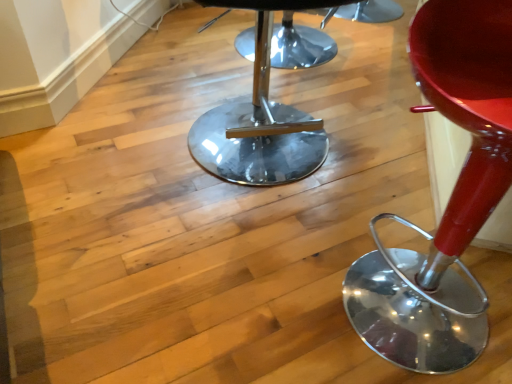
Question: Considering the relative positions of glossy red stool at right and polished chrome stool at center in the image provided, is glossy red stool at right in front of polished chrome stool at center?

Choices:
 (A) no
 (B) yes

Answer: (B)

Question: Is glossy red stool at right taller than polished chrome stool at center?

Choices:
 (A) no
 (B) yes

Answer: (B)

Question: From a real-world perspective, does glossy red stool at right sit lower than polished chrome stool at center?

Choices:
 (A) yes
 (B) no

Answer: (B)

Question: Are glossy red stool at right and polished chrome stool at center located far from each other?

Choices:
 (A) yes
 (B) no

Answer: (B)

Question: Is polished chrome stool at center surrounded by glossy red stool at right?

Choices:
 (A) no
 (B) yes

Answer: (A)

Question: From the image's perspective, would you say glossy red stool at right is shown under polished chrome stool at center?

Choices:
 (A) yes
 (B) no

Answer: (A)

Question: Are polished chrome stool at center and glossy red stool at right located far from each other?

Choices:
 (A) yes
 (B) no

Answer: (B)

Question: Does polished chrome stool at center have a lesser width compared to glossy red stool at right?

Choices:
 (A) no
 (B) yes

Answer: (A)

Question: Is polished chrome stool at center wider than glossy red stool at right?

Choices:
 (A) no
 (B) yes

Answer: (B)

Question: Is polished chrome stool at center oriented towards glossy red stool at right?

Choices:
 (A) no
 (B) yes

Answer: (B)

Question: From the image's perspective, is polished chrome stool at center on glossy red stool at right?

Choices:
 (A) yes
 (B) no

Answer: (A)

Question: Would you say polished chrome stool at center contains glossy red stool at right?

Choices:
 (A) yes
 (B) no

Answer: (B)

Question: In terms of width, does polished chrome stool at center look wider or thinner when compared to glossy red stool at right?

Choices:
 (A) wide
 (B) thin

Answer: (A)